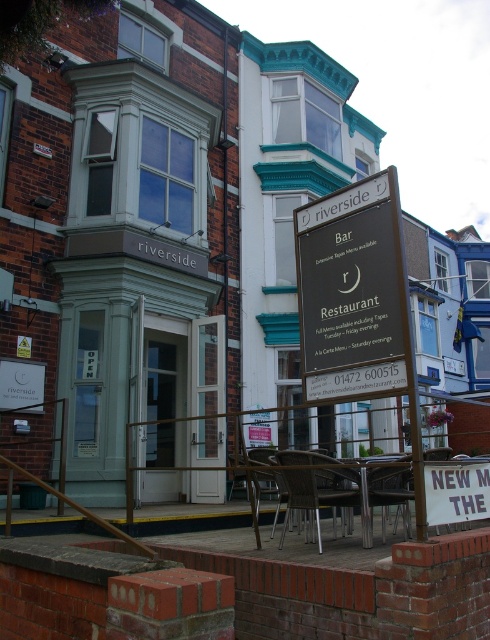
In the scene shown: How far apart are black signboard at center and metallic silver chair at center?

black signboard at center and metallic silver chair at center are 1.39 meters apart from each other.

Which is in front, point (335, 296) or point (324, 456)?

Point (335, 296) is more forward.

Locate an element on the screen. This screenshot has height=640, width=490. black signboard at center is located at coordinates (349, 289).

Is point (357, 246) farther from camera compared to point (373, 388)?

Yes, it is behind point (373, 388).

Is black signboard at center thinner than matte brown signboard at center?

Incorrect, black signboard at center's width is not less than matte brown signboard at center's.

Does point (341, 230) lie in front of point (394, 388)?

That is False.

In order to click on black signboard at center in this screenshot , I will do `click(349, 289)`.

Between white wooden sign at center and matte brown signboard at center, which one has less height?

matte brown signboard at center

Is white wooden sign at center above matte brown signboard at center?

No, white wooden sign at center is not above matte brown signboard at center.

Between point (455, 515) and point (340, 392), which one is positioned behind?

The point (340, 392) is more distant.

Find the location of a particular element. white wooden sign at center is located at coordinates (456, 492).